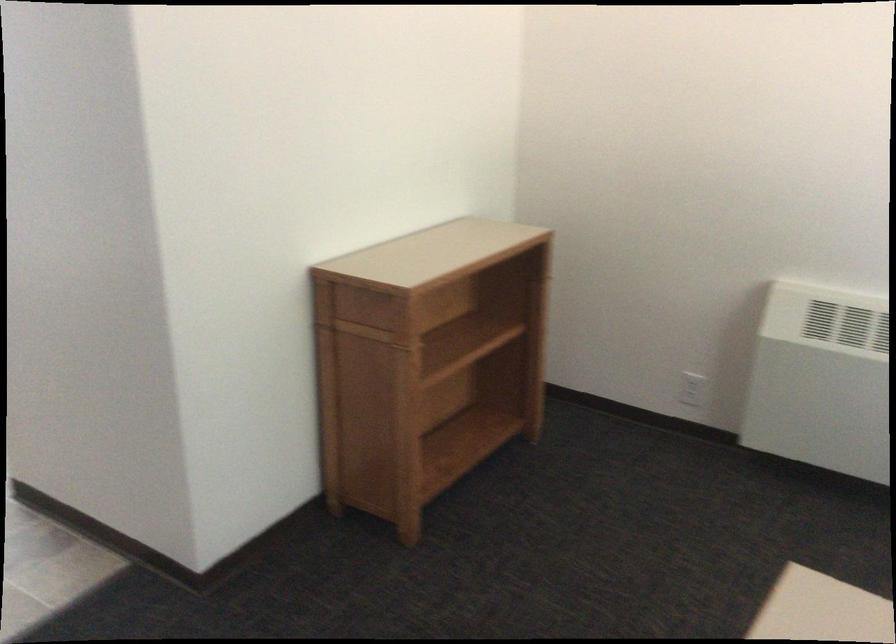
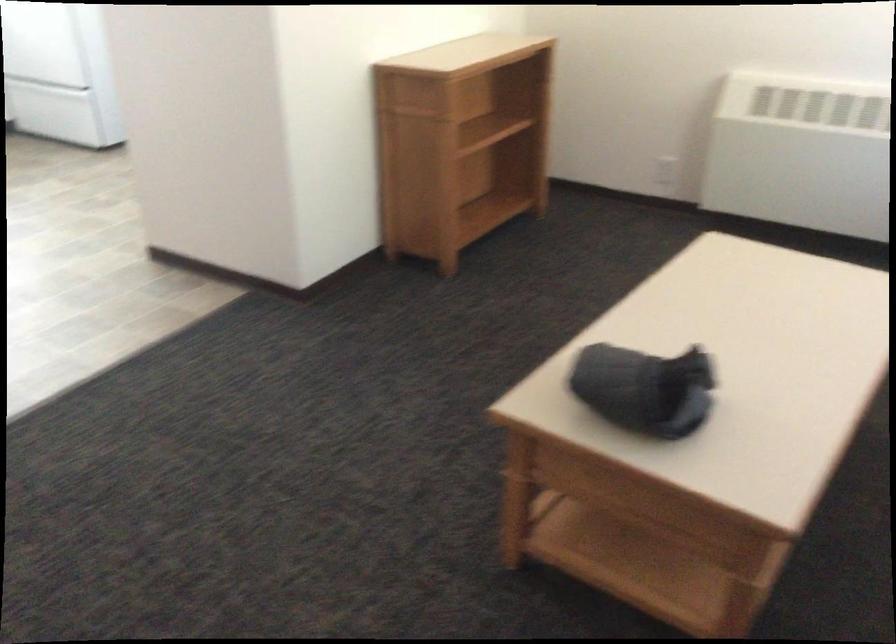
Question: Which direction would the cameraman need to move to produce the second image? Reply with the corresponding letter.

Choices:
 (A) Left
 (B) Right
 (C) Forward
 (D) Backward

Answer: (D)